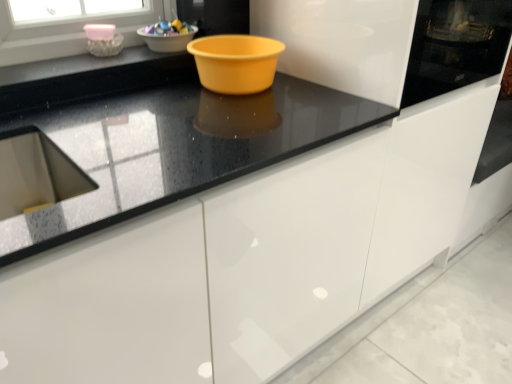
Identify the location of vacant space that's between pink glass bowl at upper left, the 2th basin when ordered from right to left, and matte plastic bowl at upper center, acting as the second basin starting from the left. (137, 53).